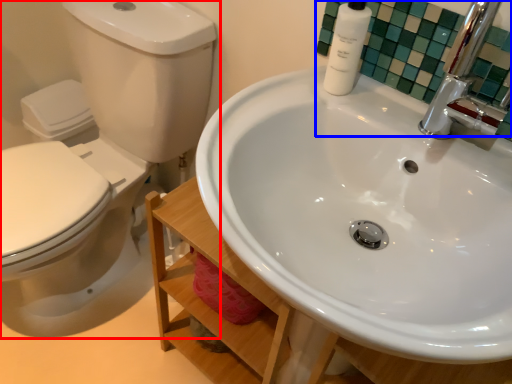
Question: Among these objects, which one is farthest to the camera, toilet (highlighted by a red box) or mirror (highlighted by a blue box)?

Choices:
 (A) toilet
 (B) mirror

Answer: (B)